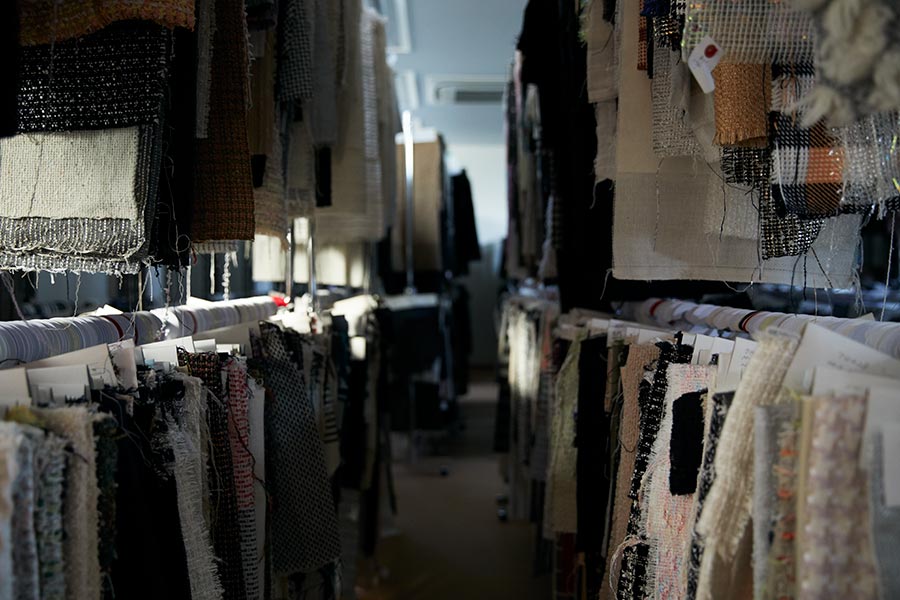
Find the location of a particular element. Image resolution: width=900 pixels, height=600 pixels. floor/carpet is located at coordinates (473, 478), (450, 553), (487, 560), (432, 518).